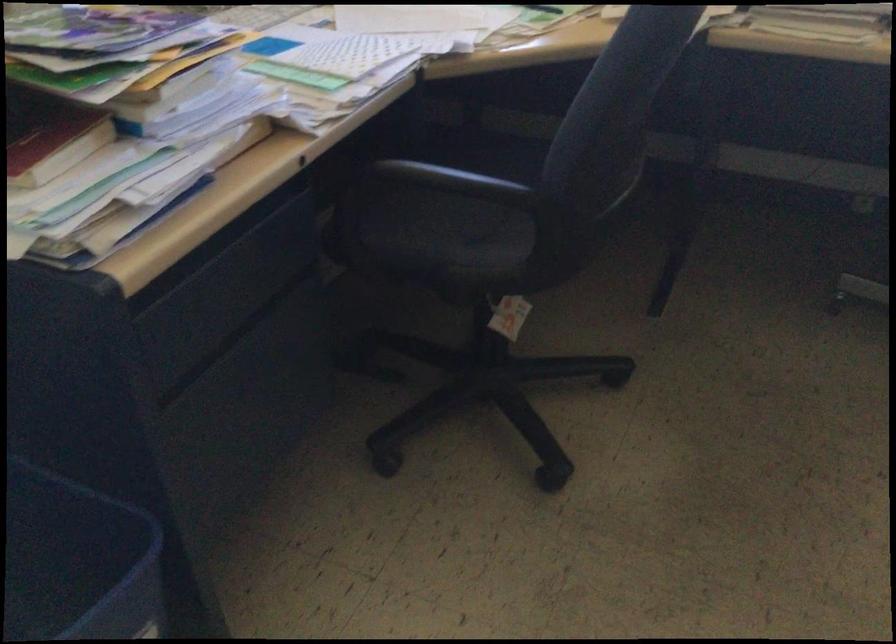
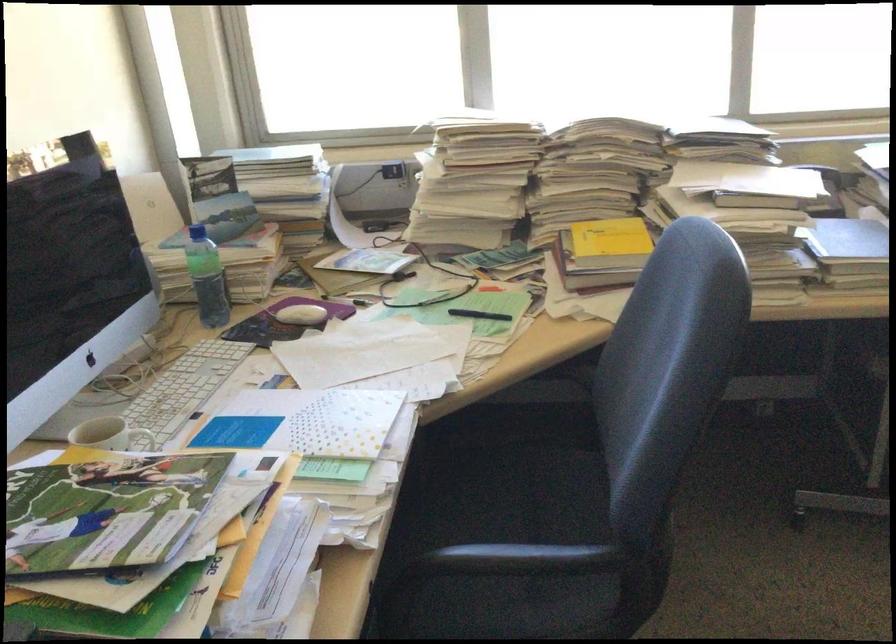
Question: The images are taken continuously from a first-person perspective. In which direction is your viewpoint rotating?

Choices:
 (A) Left
 (B) Right
 (C) Up
 (D) Down

Answer: (B)